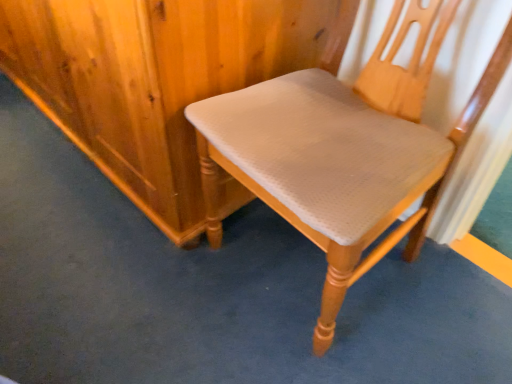
What is the approximate width of light brown wood chair at center?

The width of light brown wood chair at center is 21.04 inches.

Find the location of a particular element. This screenshot has height=384, width=512. light brown wood chair at center is located at coordinates (343, 152).

The image size is (512, 384). Describe the element at coordinates (343, 152) in the screenshot. I see `light brown wood chair at center` at that location.

This screenshot has width=512, height=384. In order to click on light brown wood chair at center in this screenshot , I will do pos(343,152).